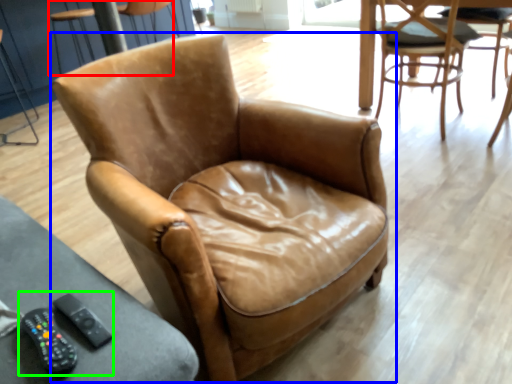
Question: Based on their relative distances, which object is farther from chair (highlighted by a red box)? Choose from chair (highlighted by a blue box) and game controller (highlighted by a green box).

Choices:
 (A) chair
 (B) game controller

Answer: (B)